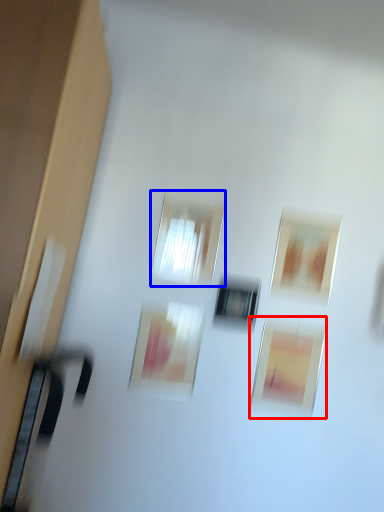
Question: Which of the following is the closest to the observer, picture frame (highlighted by a red box) or window (highlighted by a blue box)?

Choices:
 (A) picture frame
 (B) window

Answer: (B)